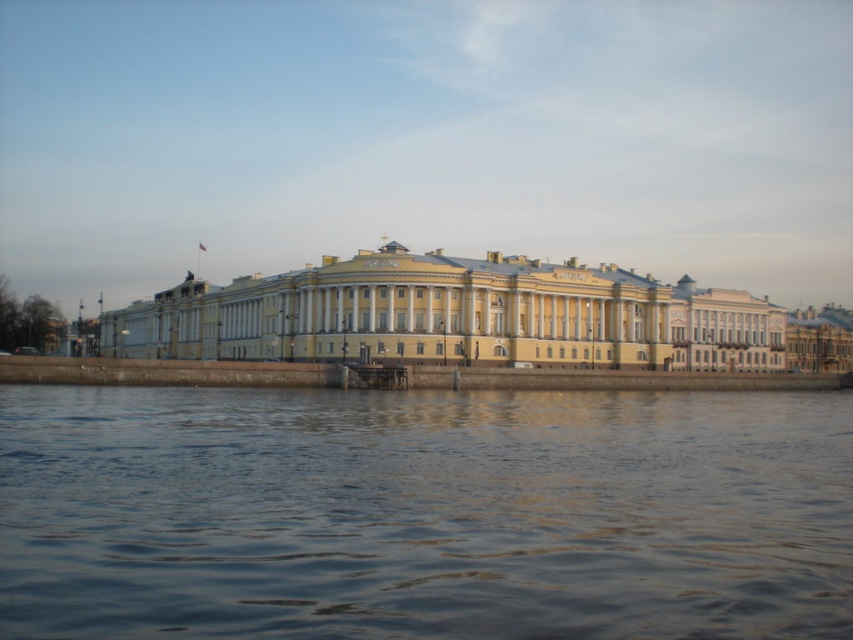
Who is shorter, blue water at lower center or yellow matte building at center?

blue water at lower center

Between point (641, 612) and point (518, 301), which one is positioned in front?

Point (641, 612)

Identify the location of blue water at lower center. The width and height of the screenshot is (853, 640). (422, 513).